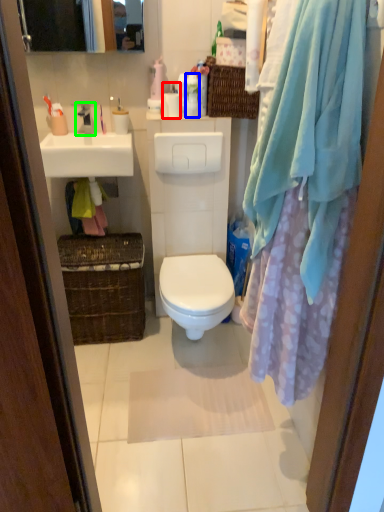
Question: Which object is the closest to the toiletry (highlighted by a red box)? Choose among these: toiletry (highlighted by a blue box) or tap (highlighted by a green box).

Choices:
 (A) toiletry
 (B) tap

Answer: (A)